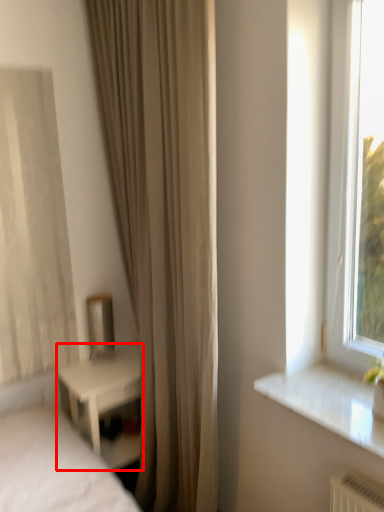
Question: From the image's perspective, what is the correct spatial positioning of nightstand (annotated by the red box) in reference to curtain?

Choices:
 (A) above
 (B) below

Answer: (B)